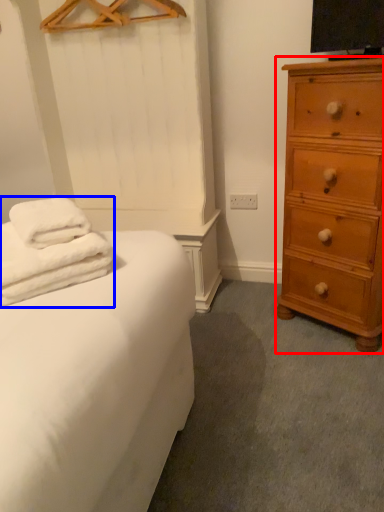
Question: Which object is further to the camera taking this photo, chest of drawers (highlighted by a red box) or bath towel (highlighted by a blue box)?

Choices:
 (A) chest of drawers
 (B) bath towel

Answer: (A)